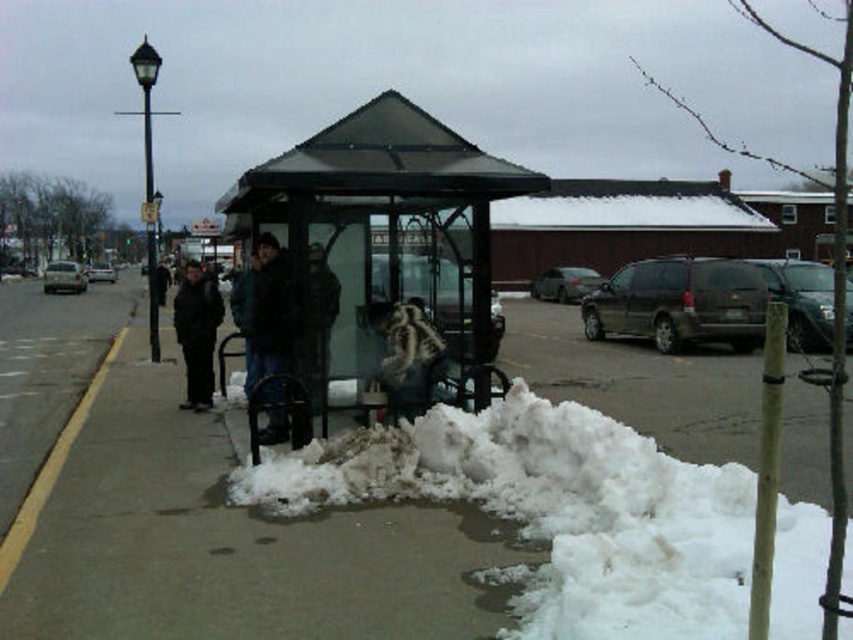
Who is more distant from viewer, [393,330] or [175,310]?

The point [175,310] is behind.

This screenshot has width=853, height=640. What are the coordinates of `fuzzy fabric bag at center` in the screenshot? It's located at (407, 356).

Locate an element on the screen. fuzzy fabric bag at center is located at coordinates (407, 356).

Which is above, white fluffy snow at lower center or transparent glass bus stop at center?

transparent glass bus stop at center is higher up.

Is white fluffy snow at lower center shorter than transparent glass bus stop at center?

Yes.

Is point (782, 561) positioned behind point (264, 216)?

That is False.

The height and width of the screenshot is (640, 853). I want to click on white fluffy snow at lower center, so click(552, 512).

Between transparent glass bus stop at center and fuzzy fabric bag at center, which one is positioned lower?

fuzzy fabric bag at center

Is transparent glass bus stop at center further to the viewer compared to fuzzy fabric bag at center?

That is False.

Image resolution: width=853 pixels, height=640 pixels. In order to click on transparent glass bus stop at center in this screenshot , I will do `click(386, 220)`.